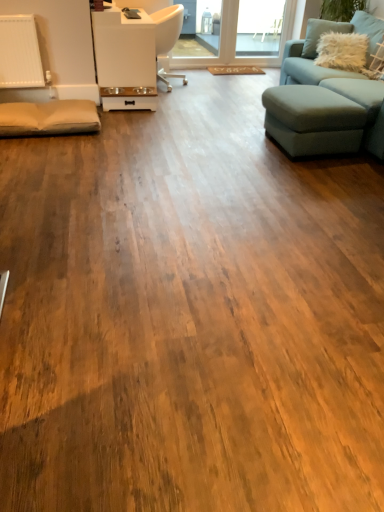
This screenshot has height=512, width=384. Describe the element at coordinates (259, 27) in the screenshot. I see `transparent glass window at upper center` at that location.

Describe the element at coordinates (236, 41) in the screenshot. The height and width of the screenshot is (512, 384). I see `transparent glass screen door at upper center` at that location.

What do you see at coordinates (313, 120) in the screenshot? The height and width of the screenshot is (512, 384). I see `light blue fabric footrest at right` at bounding box center [313, 120].

You are a GUI agent. You are given a task and a screenshot of the screen. Output one action in this format:
    pyautogui.click(x=<x>, y=<y>)
    Task: Click on the transparent glass window at upper center
    This screenshot has height=512, width=384.
    Given the screenshot: What is the action you would take?
    pyautogui.click(x=259, y=27)

Which is more to the left, white fluffy pillow at upper right or transparent glass screen door at upper center?

Positioned to the left is transparent glass screen door at upper center.

Between point (329, 47) and point (226, 60), which one is positioned in front?

The point (329, 47) is more forward.

Does white fluffy pillow at upper right have a smaller size compared to transparent glass screen door at upper center?

Indeed, white fluffy pillow at upper right has a smaller size compared to transparent glass screen door at upper center.

Is white fluffy pillow at upper right inside the boundaries of transparent glass screen door at upper center, or outside?

white fluffy pillow at upper right is not enclosed by transparent glass screen door at upper center.

Could you measure the distance between transparent glass screen door at upper center and light blue fabric footrest at right?

They are 8.02 feet apart.

Is light blue fabric footrest at right at the back of transparent glass screen door at upper center?

No, transparent glass screen door at upper center's orientation is not away from light blue fabric footrest at right.

Would you say light blue fabric footrest at right is part of transparent glass screen door at upper center's contents?

That's incorrect, light blue fabric footrest at right is not inside transparent glass screen door at upper center.

Does transparent glass screen door at upper center come behind light blue fabric footrest at right?

That is True.

Is light blue fabric footrest at right not close to white fluffy pillow at upper right?

light blue fabric footrest at right is far away from white fluffy pillow at upper right.

Locate an element on the screen. Image resolution: width=384 pixels, height=512 pixels. footrest on the left side of white fluffy pillow at upper right is located at coordinates (313, 120).

Who is more distant, light blue fabric footrest at right or white fluffy pillow at upper right?

white fluffy pillow at upper right is further from the camera.

How different are the orientations of light blue fabric footrest at right and white fluffy pillow at upper right in degrees?

70.2 degrees separate the facing orientations of light blue fabric footrest at right and white fluffy pillow at upper right.

In the scene shown: From the image's perspective, who appears lower, teal fabric studio couch at right or transparent glass window at upper center?

teal fabric studio couch at right.

Considering the sizes of objects teal fabric studio couch at right and transparent glass window at upper center in the image provided, who is taller, teal fabric studio couch at right or transparent glass window at upper center?

Standing taller between the two is teal fabric studio couch at right.

At what (x,y) coordinates should I click in order to perform the action: click on window screen above the teal fabric studio couch at right (from the image's perspective). Please return your answer as a coordinate pair (x, y). Looking at the image, I should click on point(259,27).

Can transparent glass window at upper center be found inside teal fabric studio couch at right?

No, transparent glass window at upper center is not surrounded by teal fabric studio couch at right.

From a real-world perspective, is white fluffy pillow at upper right positioned over light blue fabric footrest at right based on gravity?

Yes, from a real-world perspective, white fluffy pillow at upper right is above light blue fabric footrest at right.

Visually, is white fluffy pillow at upper right positioned to the left or to the right of light blue fabric footrest at right?

white fluffy pillow at upper right is positioned on light blue fabric footrest at right's right side.

Is point (366, 44) farther from camera compared to point (325, 127)?

Yes, point (366, 44) is behind point (325, 127).

In the scene shown: Which object is wider, white glossy chair at upper center or white fluffy pillow at upper right?

white glossy chair at upper center is wider.

Is white glossy chair at upper center not within white fluffy pillow at upper right?

Absolutely, white glossy chair at upper center is external to white fluffy pillow at upper right.

In the scene shown: In the image, is white glossy chair at upper center positioned in front of or behind white fluffy pillow at upper right?

white glossy chair at upper center is positioned farther from the viewer than white fluffy pillow at upper right.

Considering the relative sizes of white fluffy pillow at upper right and transparent glass window at upper center in the image provided, is white fluffy pillow at upper right bigger than transparent glass window at upper center?

Yes, white fluffy pillow at upper right is bigger than transparent glass window at upper center.

Considering the points (328, 56) and (258, 51), which point is behind, point (328, 56) or point (258, 51)?

Positioned behind is point (258, 51).

Is white fluffy pillow at upper right spatially inside transparent glass window at upper center, or outside of it?

white fluffy pillow at upper right lies outside transparent glass window at upper center.

From a real-world perspective, is white fluffy pillow at upper right positioned over transparent glass window at upper center based on gravity?

Yes, from a real-world perspective, white fluffy pillow at upper right is above transparent glass window at upper center.

Image resolution: width=384 pixels, height=512 pixels. In order to click on pillow in front of the transparent glass screen door at upper center in this screenshot , I will do `click(342, 51)`.

The image size is (384, 512). Identify the location of screen door that is behind the light blue fabric footrest at right. (236, 41).

When comparing their distances from white glossy chair at upper center, does white fluffy pillow at upper right or transparent glass window at upper center seem further?

white fluffy pillow at upper right.

Which object lies nearer to the anchor point white glossy chair at upper center, transparent glass screen door at upper center or white fluffy pillow at upper right?

transparent glass screen door at upper center lies closer to white glossy chair at upper center than the other object.

Which object lies further to the anchor point white glossy chair at upper center, white glossy pet feeder at upper center or light blue fabric footrest at right?

Among the two, light blue fabric footrest at right is located further to white glossy chair at upper center.

Considering their positions, is transparent glass screen door at upper center positioned closer to teal fabric studio couch at right than white fluffy pillow at upper right?

white fluffy pillow at upper right is closer to teal fabric studio couch at right.

Looking at this image, based on their spatial positions, is light blue fabric footrest at right or teal fabric studio couch at right further from white fluffy pillow at upper right?

light blue fabric footrest at right is further to white fluffy pillow at upper right.

Looking at this image, when comparing their distances from transparent glass window at upper center, does white glossy pet feeder at upper center or white glossy chair at upper center seem closer?

white glossy chair at upper center is closer to transparent glass window at upper center.

Estimate the real-world distances between objects in this image. Which object is further from light blue fabric footrest at right, white fluffy pillow at upper right or white glossy pet feeder at upper center?

white glossy pet feeder at upper center is further to light blue fabric footrest at right.

When comparing their distances from white glossy chair at upper center, does transparent glass screen door at upper center or transparent glass window at upper center seem closer?

Among the two, transparent glass screen door at upper center is located nearer to white glossy chair at upper center.

This screenshot has height=512, width=384. I want to click on screen door between white glossy chair at upper center and white fluffy pillow at upper right, so click(x=236, y=41).

In order to click on pillow situated between white glossy chair at upper center and teal fabric studio couch at right from left to right in this screenshot , I will do `click(342, 51)`.

Identify the location of chair between white glossy pet feeder at upper center and teal fabric studio couch at right. (168, 38).

I want to click on pillow between light blue fabric footrest at right and transparent glass screen door at upper center from front to back, so click(x=342, y=51).